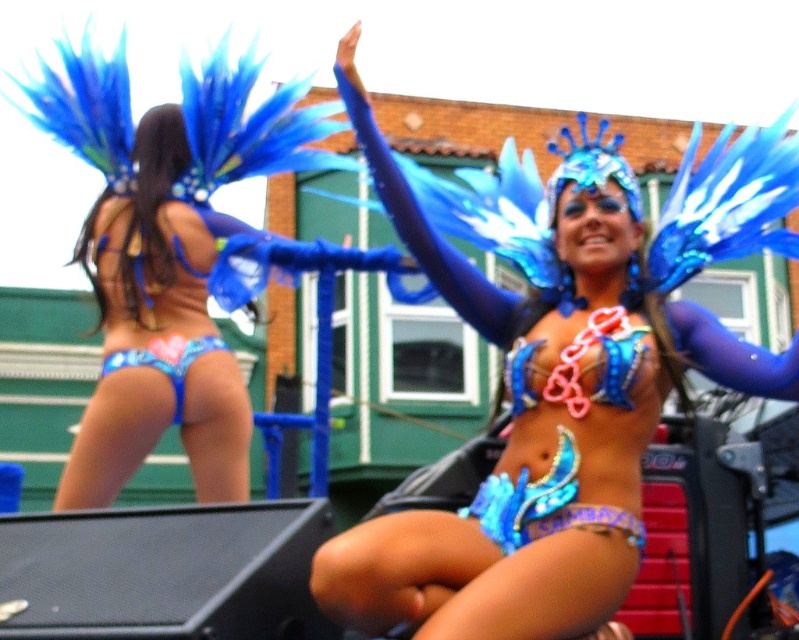
Question: Which point is closer to the camera?

Choices:
 (A) shiny blue costume at center
 (B) blue sequined bikini bottom at lower left

Answer: (A)

Question: Can you confirm if shiny blue costume at center is smaller than blue sequined bikini bottom at lower left?

Choices:
 (A) yes
 (B) no

Answer: (B)

Question: Which point is farther to the camera?

Choices:
 (A) blue sequined bikini bottom at lower left
 (B) shiny blue costume at center

Answer: (A)

Question: Can you confirm if shiny blue costume at center is positioned above blue sequined bikini bottom at lower left?

Choices:
 (A) yes
 (B) no

Answer: (A)

Question: Is shiny blue costume at center smaller than blue sequined bikini bottom at lower left?

Choices:
 (A) yes
 (B) no

Answer: (B)